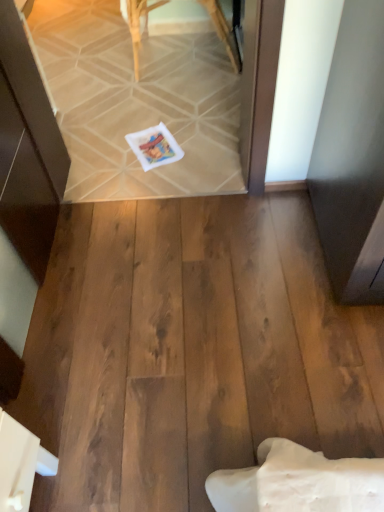
Question: Is white matte postcard at center at the back of wooden chair at upper center?

Choices:
 (A) no
 (B) yes

Answer: (A)

Question: Is the position of wooden chair at upper center more distant than that of white matte postcard at center?

Choices:
 (A) yes
 (B) no

Answer: (A)

Question: Is white matte postcard at center completely or partially inside wooden chair at upper center?

Choices:
 (A) yes
 (B) no

Answer: (B)

Question: Is wooden chair at upper center thinner than white matte postcard at center?

Choices:
 (A) no
 (B) yes

Answer: (A)

Question: Does wooden chair at upper center appear on the left side of white matte postcard at center?

Choices:
 (A) yes
 (B) no

Answer: (B)

Question: Is wooden chair at upper center far from white matte postcard at center?

Choices:
 (A) no
 (B) yes

Answer: (A)

Question: Is white matte postcard at center facing towards wooden chair at upper center?

Choices:
 (A) no
 (B) yes

Answer: (A)

Question: From a real-world perspective, is white matte postcard at center physically above wooden chair at upper center?

Choices:
 (A) no
 (B) yes

Answer: (A)

Question: Considering the relative sizes of white matte postcard at center and wooden chair at upper center in the image provided, is white matte postcard at center shorter than wooden chair at upper center?

Choices:
 (A) yes
 (B) no

Answer: (A)

Question: Is white matte postcard at center outside wooden chair at upper center?

Choices:
 (A) yes
 (B) no

Answer: (A)

Question: Is white matte postcard at center taller than wooden chair at upper center?

Choices:
 (A) no
 (B) yes

Answer: (A)

Question: Is white matte postcard at center closer to camera compared to wooden chair at upper center?

Choices:
 (A) no
 (B) yes

Answer: (B)

Question: From the image's perspective, is wooden chair at upper center above or below white matte postcard at center?

Choices:
 (A) below
 (B) above

Answer: (B)